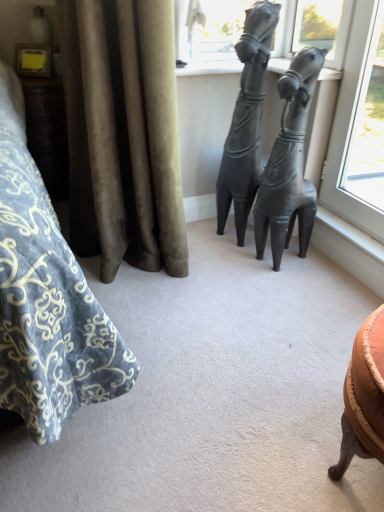
Question: From the image's perspective, is velvet curtain at left on matte black statue at center, acting as the second statue (sculpture) starting from the right?

Choices:
 (A) no
 (B) yes

Answer: (B)

Question: Is velvet curtain at left placed right next to matte black statue at center, acting as the second statue (sculpture) starting from the right?

Choices:
 (A) no
 (B) yes

Answer: (A)

Question: Does velvet curtain at left appear on the right side of matte black statue at center, the first statue (sculpture) in the left-to-right sequence?

Choices:
 (A) yes
 (B) no

Answer: (B)

Question: Does velvet curtain at left appear on the left side of matte black statue at center, the first statue (sculpture) in the left-to-right sequence?

Choices:
 (A) no
 (B) yes

Answer: (B)

Question: Considering the relative sizes of velvet curtain at left and matte black statue at center, the first statue (sculpture) in the left-to-right sequence, in the image provided, is velvet curtain at left thinner than matte black statue at center, the first statue (sculpture) in the left-to-right sequence,?

Choices:
 (A) no
 (B) yes

Answer: (A)

Question: Is velvet curtain at left shorter than matte black statue at center, the first statue (sculpture) in the left-to-right sequence?

Choices:
 (A) no
 (B) yes

Answer: (B)

Question: Can you confirm if matte black statue at center, acting as the second statue (sculpture) starting from the right, is bigger than velvet curtain at left?

Choices:
 (A) yes
 (B) no

Answer: (B)

Question: Is matte black statue at center, acting as the second statue (sculpture) starting from the right, oriented towards velvet curtain at left?

Choices:
 (A) no
 (B) yes

Answer: (B)

Question: Is matte black statue at center, acting as the second statue (sculpture) starting from the right, to the left of velvet curtain at left from the viewer's perspective?

Choices:
 (A) no
 (B) yes

Answer: (A)

Question: Is matte black statue at center, the first statue (sculpture) in the left-to-right sequence, in front of velvet curtain at left?

Choices:
 (A) yes
 (B) no

Answer: (B)

Question: Are matte black statue at center, acting as the second statue (sculpture) starting from the right, and velvet curtain at left far apart?

Choices:
 (A) yes
 (B) no

Answer: (B)

Question: Is matte black statue at center, acting as the second statue (sculpture) starting from the right, shorter than velvet curtain at left?

Choices:
 (A) yes
 (B) no

Answer: (B)

Question: From the image's perspective, is velvet curtain at left above matte black statue at center, which appears as the first statue (sculpture) when viewed from the right?

Choices:
 (A) no
 (B) yes

Answer: (B)